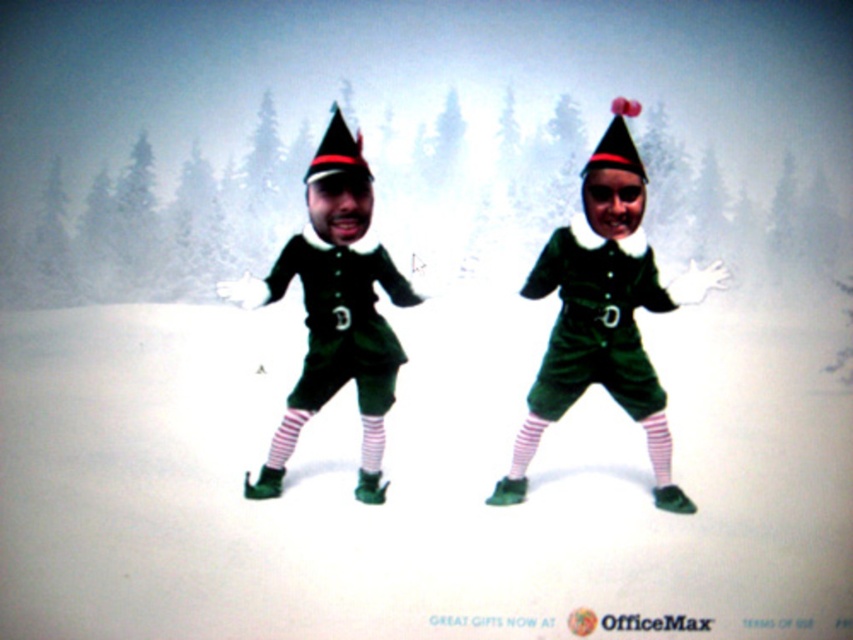
Is point (599, 157) more distant than point (518, 429)?

No, (599, 157) is closer to viewer.

How much distance is there between matte black christmas hat at upper center and white striped sock at center?

matte black christmas hat at upper center and white striped sock at center are 71.70 centimeters apart from each other.

The height and width of the screenshot is (640, 853). What do you see at coordinates (618, 141) in the screenshot? I see `matte black christmas hat at upper center` at bounding box center [618, 141].

Image resolution: width=853 pixels, height=640 pixels. I want to click on matte black christmas hat at upper center, so 618,141.

Which of these two, green velvet elf at center or matte black christmas hat at upper center, stands shorter?

matte black christmas hat at upper center

Between point (648, 452) and point (607, 131), which one is positioned in front?

Point (607, 131) is more forward.

Is point (546, 365) closer to viewer compared to point (599, 147)?

No.

You are a GUI agent. You are given a task and a screenshot of the screen. Output one action in this format:
    pyautogui.click(x=<x>, y=<y>)
    Task: Click on the green velvet elf at center
    This screenshot has width=853, height=640.
    Given the screenshot: What is the action you would take?
    pyautogui.click(x=610, y=301)

Who is higher up, green matte elf costume at center or matte black christmas hat at upper center?

matte black christmas hat at upper center is above.

Which is behind, point (303, 381) or point (625, 100)?

The point (303, 381) is behind.

What are the coordinates of `green matte elf costume at center` in the screenshot? It's located at (334, 308).